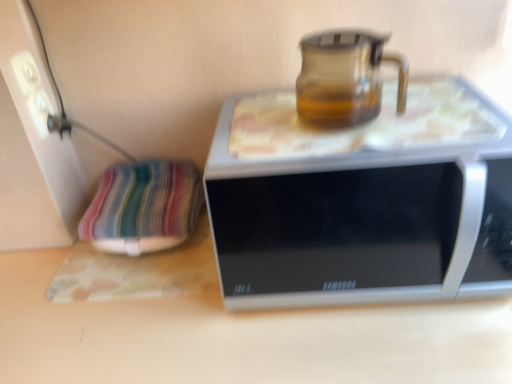
Where is `free location in front of transparent glass jug at upper center`? The height and width of the screenshot is (384, 512). free location in front of transparent glass jug at upper center is located at coordinates (369, 159).